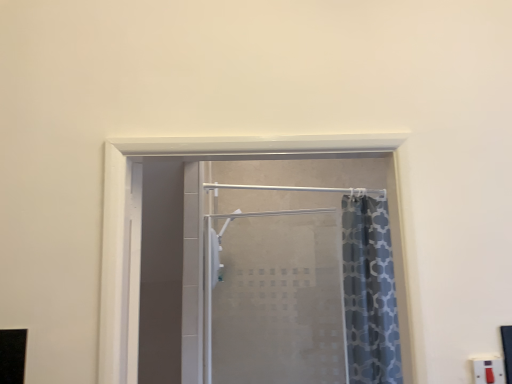
Question: Considering the positions of white plastic electric outlet at lower right and frosted glass shower door at center in the image, is white plastic electric outlet at lower right bigger or smaller than frosted glass shower door at center?

Choices:
 (A) small
 (B) big

Answer: (A)

Question: Based on their positions, is white plastic electric outlet at lower right located to the left or right of frosted glass shower door at center?

Choices:
 (A) left
 (B) right

Answer: (B)

Question: In terms of height, does white plastic electric outlet at lower right look taller or shorter compared to frosted glass shower door at center?

Choices:
 (A) tall
 (B) short

Answer: (B)

Question: In terms of height, does frosted glass shower door at center look taller or shorter compared to white plastic electric outlet at lower right?

Choices:
 (A) short
 (B) tall

Answer: (B)

Question: From the image's perspective, is frosted glass shower door at center located above or below white plastic electric outlet at lower right?

Choices:
 (A) above
 (B) below

Answer: (B)

Question: Is frosted glass shower door at center inside the boundaries of white plastic electric outlet at lower right, or outside?

Choices:
 (A) outside
 (B) inside

Answer: (A)

Question: Considering the relative positions of frosted glass shower door at center and white plastic electric outlet at lower right in the image provided, is frosted glass shower door at center to the left or to the right of white plastic electric outlet at lower right?

Choices:
 (A) right
 (B) left

Answer: (B)